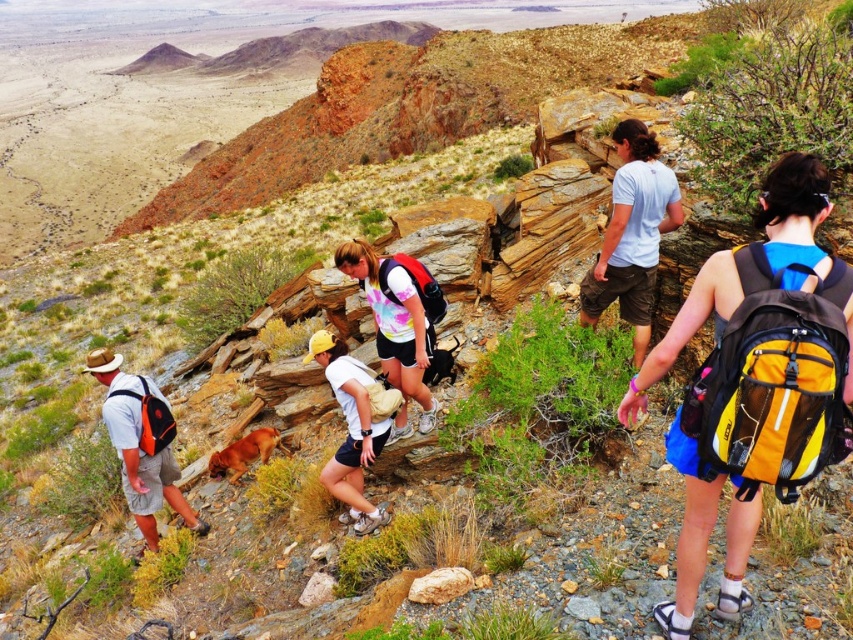
You are a hiker looking at the image of the rocky trail. There is a point marked at coordinates (398, 323). What object in the image corresponds to this point?

The point at coordinates (398, 323) corresponds to the white tie dye t shirt at center.